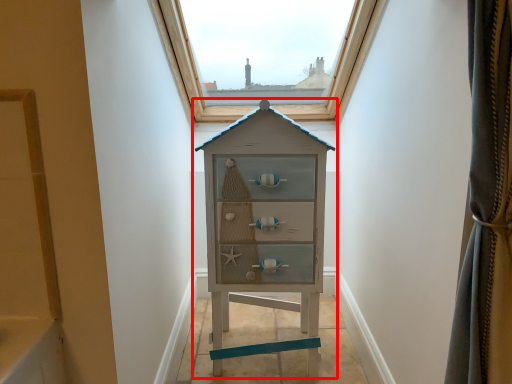
Question: In this image, where is chest of drawers (annotated by the red box) located relative to window?

Choices:
 (A) left
 (B) right

Answer: (B)